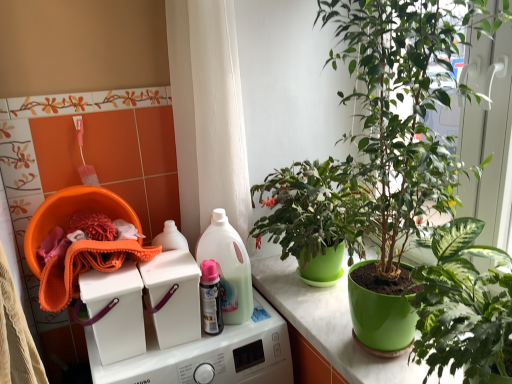
Question: Is green glossy pot at center, which ranks as the first houseplant in top-to-bottom order, next to white plastic washing machine at center, the 3th washing machine when ordered from bottom to top?

Choices:
 (A) no
 (B) yes

Answer: (A)

Question: Considering the relative positions of green glossy pot at center, which ranks as the first houseplant in top-to-bottom order, and white plastic washing machine at center, marked as the 1th washing machine in a top-to-bottom arrangement, in the image provided, is green glossy pot at center, which ranks as the first houseplant in top-to-bottom order, in front of white plastic washing machine at center, marked as the 1th washing machine in a top-to-bottom arrangement,?

Choices:
 (A) yes
 (B) no

Answer: (A)

Question: From a real-world perspective, is green glossy pot at center, the second houseplant ordered from the bottom, physically above white plastic washing machine at center, marked as the 1th washing machine in a top-to-bottom arrangement?

Choices:
 (A) yes
 (B) no

Answer: (A)

Question: Is green glossy pot at center, which ranks as the first houseplant in top-to-bottom order, at the right side of white plastic washing machine at center, the 3th washing machine when ordered from bottom to top?

Choices:
 (A) yes
 (B) no

Answer: (A)

Question: Is green glossy pot at center, the second houseplant ordered from the bottom, looking in the opposite direction of white plastic washing machine at center, the 3th washing machine when ordered from bottom to top?

Choices:
 (A) no
 (B) yes

Answer: (A)

Question: From their relative heights in the image, would you say white plastic washing machine at center, which is the 1th washing machine from bottom to top, is taller or shorter than orange microfiber cloth at left?

Choices:
 (A) tall
 (B) short

Answer: (A)

Question: From the image's perspective, relative to orange microfiber cloth at left, is white plastic washing machine at center, which is the third washing machine from top to bottom, above or below?

Choices:
 (A) below
 (B) above

Answer: (A)

Question: Would you say white plastic washing machine at center, which is the third washing machine from top to bottom, is inside or outside orange microfiber cloth at left?

Choices:
 (A) outside
 (B) inside

Answer: (A)

Question: Considering their positions, is white plastic washing machine at center, which is the 1th washing machine from bottom to top, located in front of or behind orange microfiber cloth at left?

Choices:
 (A) behind
 (B) front

Answer: (B)

Question: Based on their sizes in the image, would you say green glossy pot at right, positioned as the first houseplant in bottom-to-top order, is bigger or smaller than green glossy pot at center?

Choices:
 (A) small
 (B) big

Answer: (B)

Question: Is green glossy pot at right, the second houseplant positioned from the top, situated inside green glossy pot at center or outside?

Choices:
 (A) inside
 (B) outside

Answer: (B)

Question: Is point (414, 344) closer or farther from the camera than point (332, 304)?

Choices:
 (A) farther
 (B) closer

Answer: (B)

Question: In terms of height, does green glossy pot at right, positioned as the first houseplant in bottom-to-top order, look taller or shorter compared to green glossy pot at center?

Choices:
 (A) short
 (B) tall

Answer: (B)

Question: Is point (234, 269) positioned closer to the camera than point (214, 296)?

Choices:
 (A) farther
 (B) closer

Answer: (A)

Question: Which is correct: translucent plastic bottle at center is inside pink glossy spray can at center, or outside of it?

Choices:
 (A) inside
 (B) outside

Answer: (B)